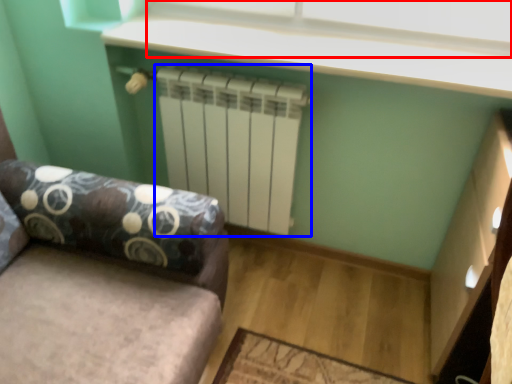
Question: Which object appears closest to the camera in this image, window screen (highlighted by a red box) or radiator (highlighted by a blue box)?

Choices:
 (A) window screen
 (B) radiator

Answer: (A)